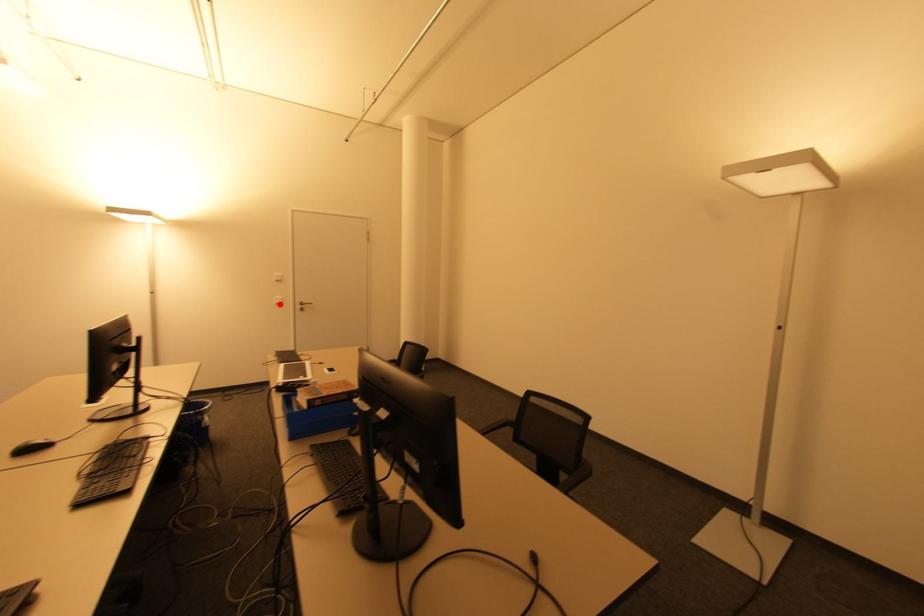
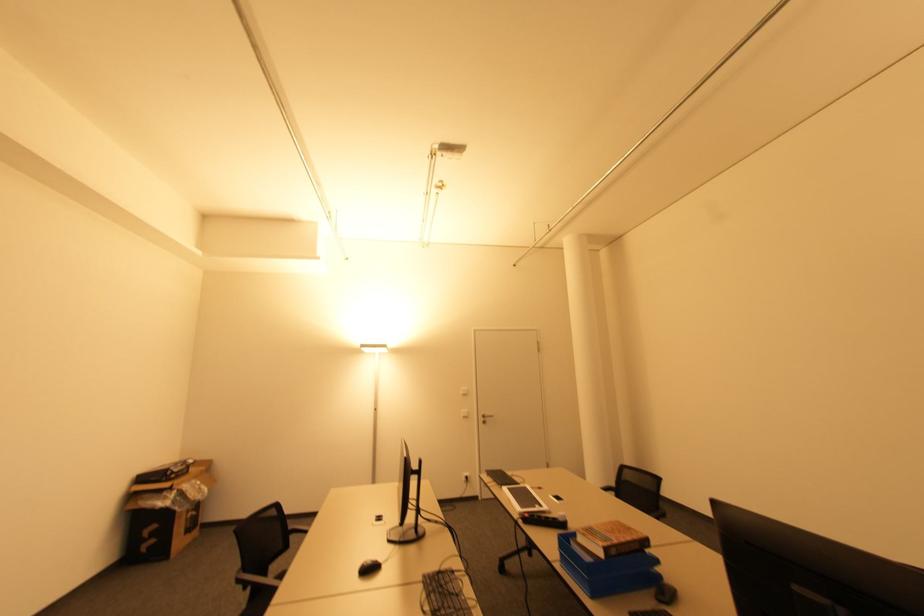
The point at the highlighted location is marked in the first image. Where is the corresponding point in the second image?

(467, 416)